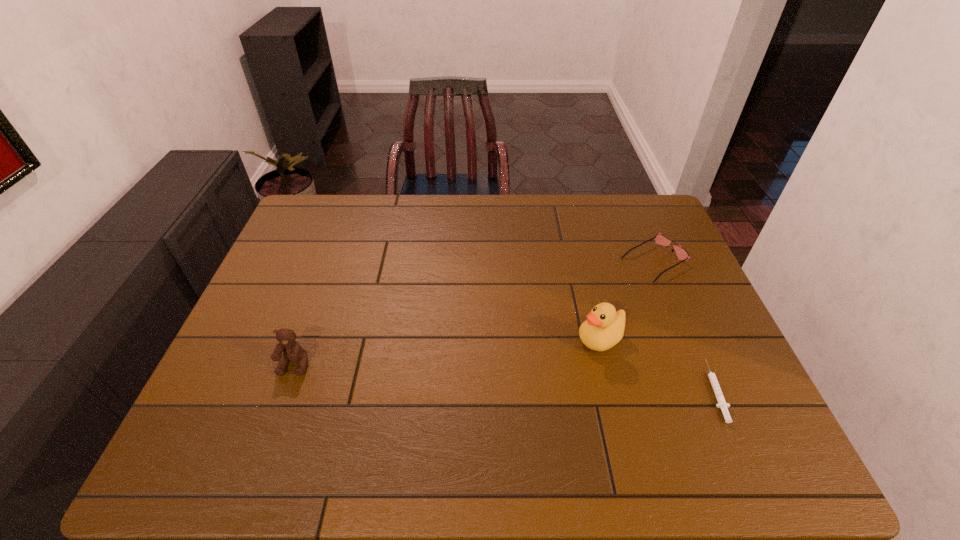
You are a GUI agent. You are given a task and a screenshot of the screen. Output one action in this format:
    pyautogui.click(x=<x>, y=<y>)
    Task: Click on the third shortest object
    The height and width of the screenshot is (540, 960).
    Given the screenshot: What is the action you would take?
    pyautogui.click(x=291, y=349)

Identify the location of the leftmost object. (291, 349).

What are the coordinates of `the shortest object` in the screenshot? It's located at (722, 404).

The image size is (960, 540). I want to click on the third object from right to left, so click(x=604, y=328).

Where is `the tallest object`? The width and height of the screenshot is (960, 540). the tallest object is located at coordinates (604, 328).

Locate an element on the screen. This screenshot has height=540, width=960. the farthest object is located at coordinates (659, 238).

The image size is (960, 540). In order to click on sunglasses in this screenshot , I will do `click(659, 238)`.

What are the coordinates of `vacant region located on the face of the teddy bear` in the screenshot? It's located at (276, 414).

In order to click on free point located on the back of the shortest object in this screenshot , I will do pyautogui.click(x=683, y=318).

Where is `free space located at the beak of the second object from left to right`? This screenshot has width=960, height=540. free space located at the beak of the second object from left to right is located at coordinates (540, 369).